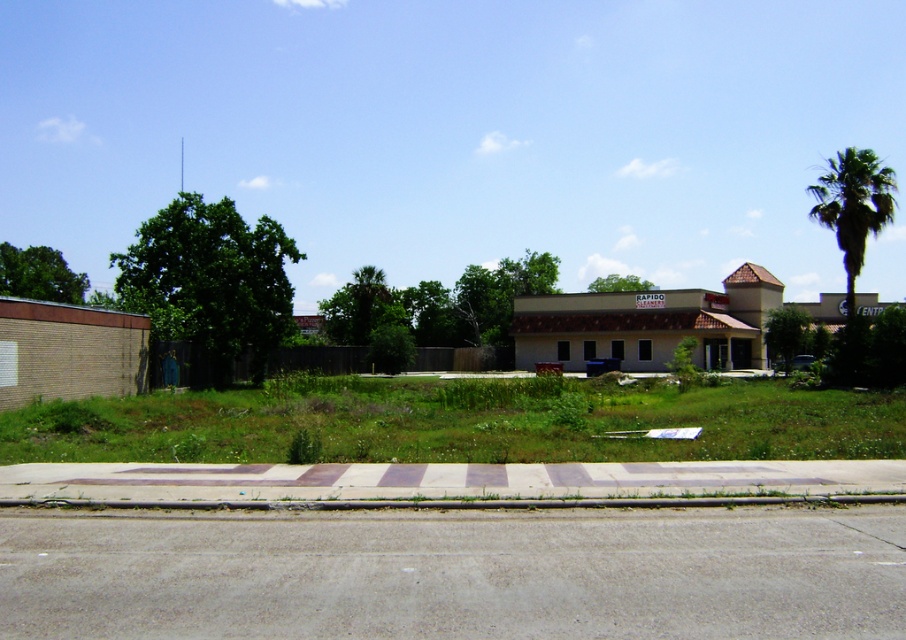
The image size is (906, 640). What do you see at coordinates (210, 282) in the screenshot? I see `green leafy tree at left` at bounding box center [210, 282].

Which of these two, green leafy tree at left or green leafy tree at center, stands shorter?

green leafy tree at center

Is point (248, 320) positioned after point (789, 339)?

No, it is not.

This screenshot has width=906, height=640. Find the location of `green leafy tree at left`. green leafy tree at left is located at coordinates (210, 282).

Measure the distance between green leafy tree at center and camera.

A distance of 47.35 meters exists between green leafy tree at center and camera.

Where is `green leafy tree at center`? Image resolution: width=906 pixels, height=640 pixels. green leafy tree at center is located at coordinates (786, 330).

Looking at this image, is green leafy palm tree at right below green leafy tree at upper left?

Actually, green leafy palm tree at right is above green leafy tree at upper left.

Is point (840, 189) closer to camera compared to point (51, 296)?

Yes, it is.

Between point (847, 253) and point (40, 248), which one is positioned behind?

The point (40, 248) is behind.

You are a GUI agent. You are given a task and a screenshot of the screen. Output one action in this format:
    pyautogui.click(x=<x>, y=<y>)
    Task: Click on the green leafy palm tree at right
    
    Given the screenshot: What is the action you would take?
    pyautogui.click(x=853, y=205)